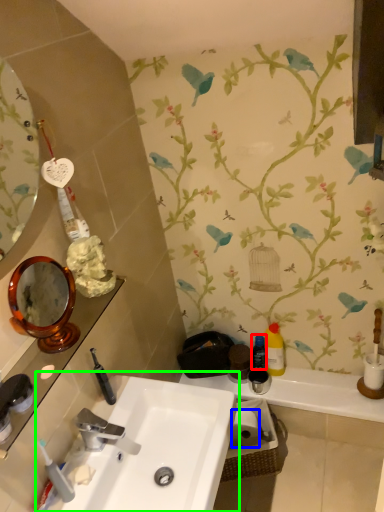
Question: Which is farther away from mouthwash (highlighted by a red box)? toilet paper (highlighted by a blue box) or sink (highlighted by a green box)?

Choices:
 (A) toilet paper
 (B) sink

Answer: (B)